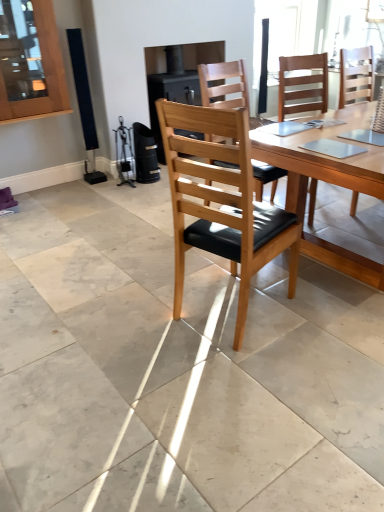
Question: Based on their sizes in the image, would you say light brown wood chair at center, marked as the second chair in a back-to-front arrangement, is bigger or smaller than wooden chair at center, arranged as the 3th chair when viewed from the front?

Choices:
 (A) big
 (B) small

Answer: (B)

Question: Relative to wooden chair at center, arranged as the 3th chair when viewed from the front, is light brown wood chair at center, the second chair in the front-to-back sequence, in front or behind?

Choices:
 (A) front
 (B) behind

Answer: (A)

Question: Which object is positioned farthest from the wooden chair at center, arranged as the 3th chair when viewed from the front?

Choices:
 (A) light brown wood chair at center, marked as the second chair in a back-to-front arrangement
 (B) wooden table at center
 (C) wooden chair with black cushion at center, which is the third chair from back to front

Answer: (C)

Question: Which of these objects is positioned closest to the wooden chair with black cushion at center, the first chair viewed from the front?

Choices:
 (A) wooden table at center
 (B) wooden chair at center, arranged as the 3th chair when viewed from the front
 (C) light brown wood chair at center, marked as the second chair in a back-to-front arrangement

Answer: (A)